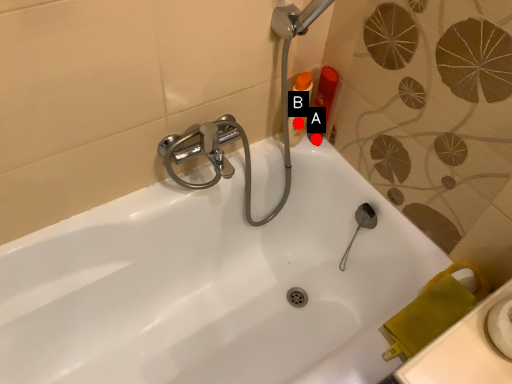
Question: Two points are circled on the image, labeled by A and B beside each circle. Which point is farther from the camera taking this photo?

Choices:
 (A) A is further
 (B) B is further

Answer: (A)